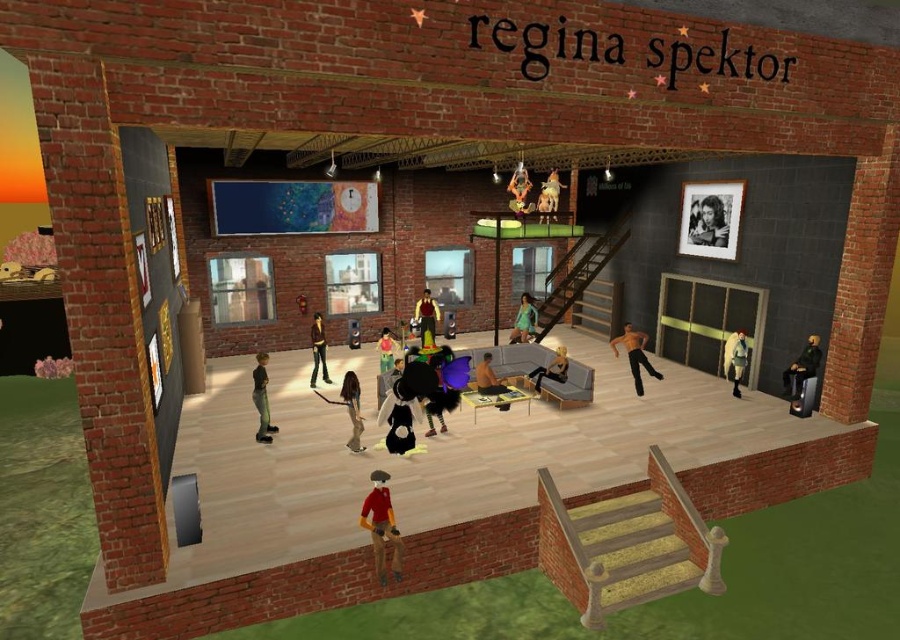
Question: Which point is closer to the camera?

Choices:
 (A) smooth blue shirt at center
 (B) black leather jacket at lower right
 (C) matte black couch at center

Answer: (A)

Question: Considering the real-world distances, which object is farthest from the smooth blue shirt at center?

Choices:
 (A) green matte dress at center
 (B) shiny red shirt at center
 (C) black leather jacket at lower right
 (D) shiny red jacket at center

Answer: (C)

Question: Can you confirm if denim pants at center is bigger than matte black couch at center?

Choices:
 (A) no
 (B) yes

Answer: (A)

Question: Can you confirm if velvet black dress at center is smaller than white matte jacket at right?

Choices:
 (A) no
 (B) yes

Answer: (A)

Question: Can you confirm if velvet black dress at center is smaller than orange fabric doll at center?

Choices:
 (A) yes
 (B) no

Answer: (B)

Question: Which of the following is the farthest from the observer?

Choices:
 (A) (734, 355)
 (B) (520, 300)

Answer: (B)